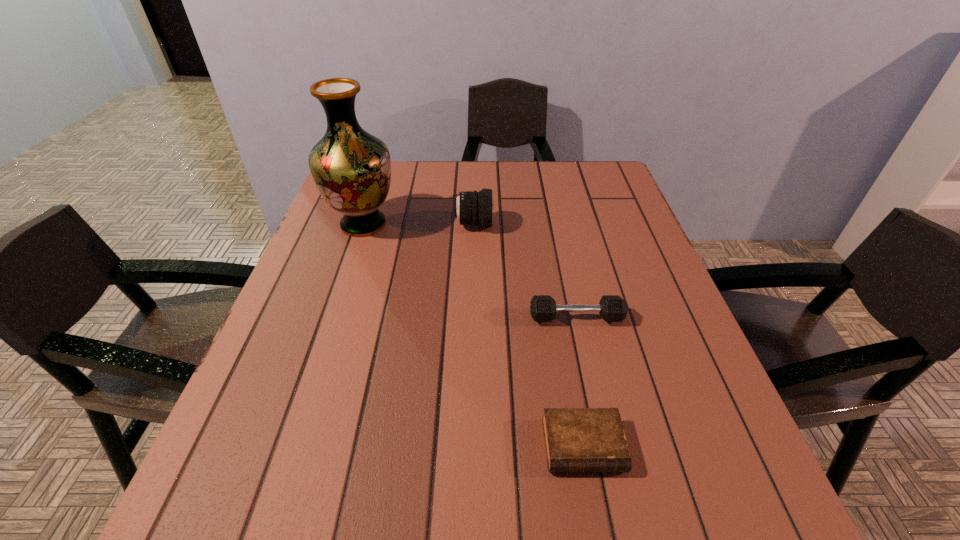
Image resolution: width=960 pixels, height=540 pixels. What are the coordinates of `vacant area between the shortest object and the second tallest object` in the screenshot? It's located at (528, 335).

Where is `free spot between the dumbbell and the nearest object`? free spot between the dumbbell and the nearest object is located at coordinates (580, 381).

Find the location of a particular element. The image size is (960, 540). free space that is in between the diary and the telephoto lens is located at coordinates [528, 335].

Where is `unoccupied area between the third shortest object and the shortest object`? This screenshot has width=960, height=540. unoccupied area between the third shortest object and the shortest object is located at coordinates (528, 335).

Locate an element on the screen. vacant space that is in between the telephoto lens and the diary is located at coordinates (528, 335).

The height and width of the screenshot is (540, 960). Identify the location of unoccupied area between the vase and the telephoto lens. point(419,224).

At what (x,y) coordinates should I click in order to perform the action: click on vacant area that lies between the vase and the diary. Please return your answer as a coordinate pair (x, y). The height and width of the screenshot is (540, 960). Looking at the image, I should click on (473, 335).

The width and height of the screenshot is (960, 540). What are the coordinates of `free space between the diary and the third farthest object` in the screenshot? It's located at (580, 381).

At what (x,y) coordinates should I click in order to perform the action: click on free space between the diary and the second nearest object. Please return your answer as a coordinate pair (x, y). Looking at the image, I should click on (580, 381).

Identify the location of object that is the second closest to the third object from right to left. The width and height of the screenshot is (960, 540). (612, 308).